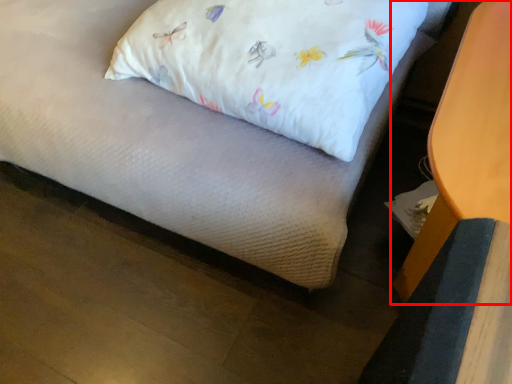
Question: From the image's perspective, where is furniture (annotated by the red box) located relative to pillow?

Choices:
 (A) below
 (B) above

Answer: (A)